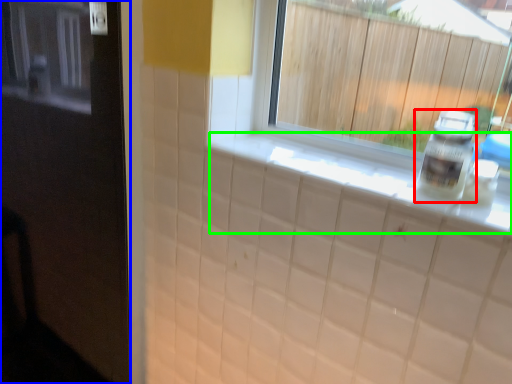
Question: Considering the real-world distances, which object is farthest from bottle (highlighted by a red box)? door (highlighted by a blue box) or counter top (highlighted by a green box)?

Choices:
 (A) door
 (B) counter top

Answer: (A)